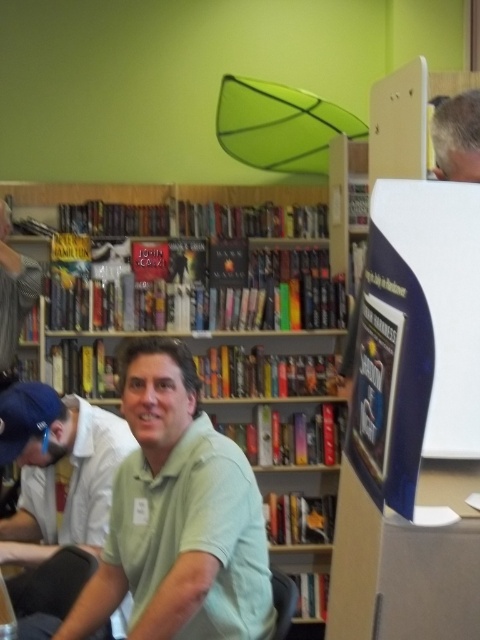
You are standing at the entrance of the bookstore and want to reach the two points marked in the image. Which point, point (219, 538) or point (456, 102), is closer to you?

Point (456, 102) is closer to you because it is in front of point (219, 538).

You are standing in the bookstore and want to determine the relative positions of two points marked in the image. Which point is closer to you, point 1 at coordinates point (143,595) or point 2 at coordinates point (80,492)?

Point 1 at coordinates point (143,595) is closer to you than point 2 at coordinates point (80,492).

Based on the scene description, which object is taller between the light green polo shirt at center and the green matte shirt at center?

The light green polo shirt at center is taller than the green matte shirt at center according to the description.